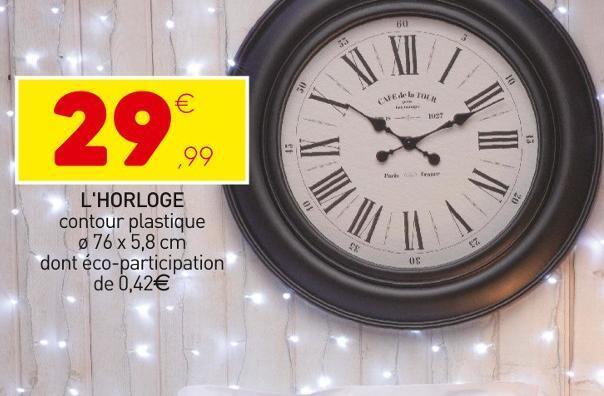
Image resolution: width=604 pixels, height=396 pixels. Identify the location of clock hour 1. (444, 72).